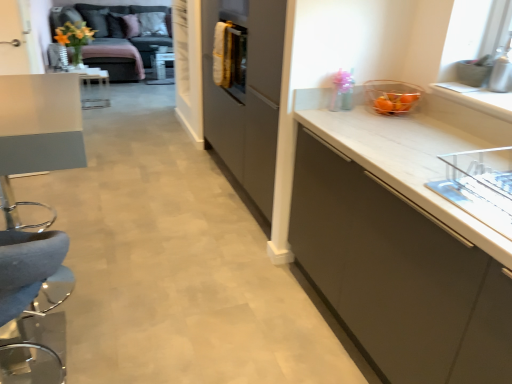
Question: Considering their positions, is translucent glass bowl at upper right located in front of or behind matte gray table at left?

Choices:
 (A) front
 (B) behind

Answer: (B)

Question: From their relative heights in the image, would you say translucent glass bowl at upper right is taller or shorter than matte gray table at left?

Choices:
 (A) tall
 (B) short

Answer: (B)

Question: Which is farther from the translucent glass bowl at upper right?

Choices:
 (A) white matte cabinet at right
 (B) matte yellow flower at upper left
 (C) matte gray table at left
 (D) velvet grey couch at upper left

Answer: (D)

Question: Which of these objects is positioned closest to the white matte cabinet at right?

Choices:
 (A) matte gray table at left
 (B) velvet grey couch at upper left
 (C) matte yellow flower at upper left
 (D) translucent glass bowl at upper right

Answer: (D)